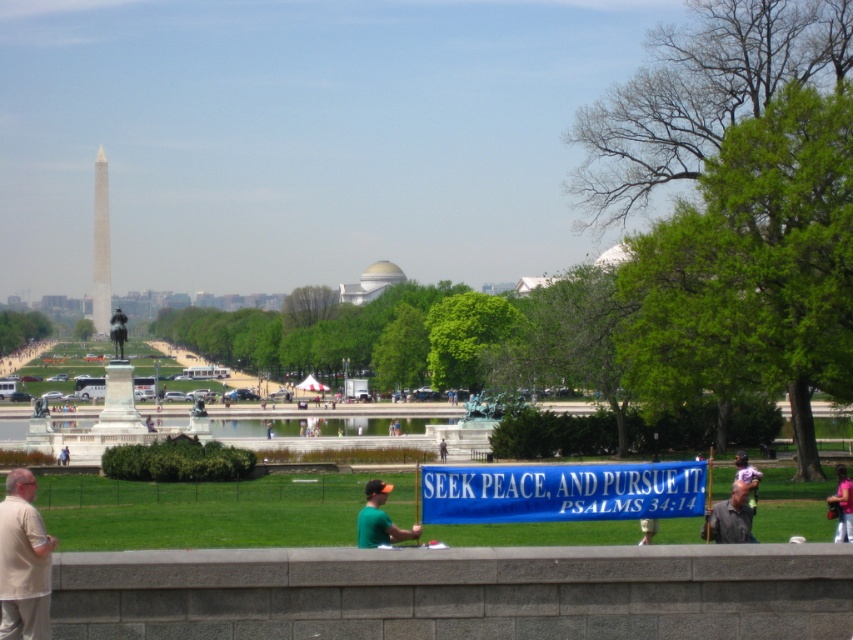
Between point (838, 509) and point (756, 468), which one is positioned in front?

Point (838, 509) is in front.

Is pink fabric shirt at lower right shorter than light purple fabric at lower right?

Yes.

The height and width of the screenshot is (640, 853). What do you see at coordinates (842, 504) in the screenshot?
I see `pink fabric shirt at lower right` at bounding box center [842, 504].

You are a GUI agent. You are given a task and a screenshot of the screen. Output one action in this format:
    pyautogui.click(x=<x>, y=<y>)
    Task: Click on the pink fabric shirt at lower right
    This screenshot has height=640, width=853.
    Given the screenshot: What is the action you would take?
    pyautogui.click(x=842, y=504)

Is blue fabric banner at center to the left of polished marble obelisk at center-left from the viewer's perspective?

Incorrect, blue fabric banner at center is not on the left side of polished marble obelisk at center-left.

Who is more forward, (610, 490) or (96, 278)?

Point (610, 490) is more forward.

Find the location of a particular element. blue fabric banner at center is located at coordinates (561, 492).

Measure the distance from blue fabric banner at center to pink fabric shirt at lower right.

blue fabric banner at center and pink fabric shirt at lower right are 12.72 meters apart from each other.

Does blue fabric banner at center have a lesser width compared to pink fabric shirt at lower right?

Yes, blue fabric banner at center is thinner than pink fabric shirt at lower right.

I want to click on blue fabric banner at center, so click(561, 492).